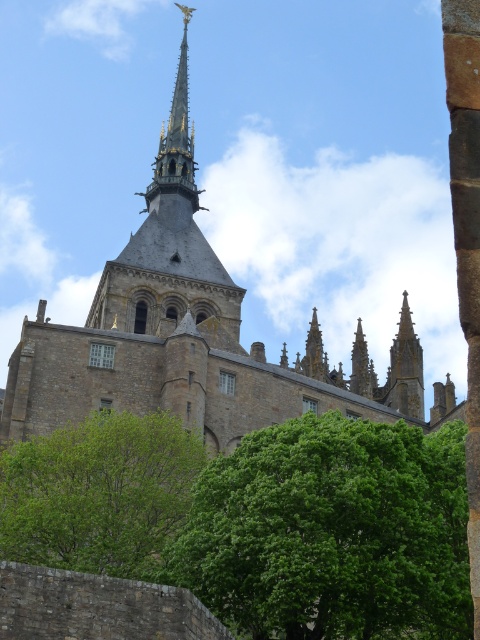
You are standing in front of the Gothic cathedral and notice two green leafy trees. Which tree, the green leafy tree at center or the green leafy tree at lower left, is located more to the left?

The green leafy tree at lower left is more to the left because the green leafy tree at center is positioned on the right side of it.

You are standing in front of the dark gray stone church tower at center and want to take a photo of the green leafy tree at lower left. Which direction should you turn to frame the tree in your camera?

The dark gray stone church tower at center is taller than the green leafy tree at lower left. To frame the tree in your camera, you should turn to the left side of the church tower since the tree is positioned at the lower left relative to the tower.

You are standing in a field and see the green leafy tree at lower left and the dark gray stone church tower at center. Which object appears smaller in the image?

The green leafy tree at lower left appears smaller compared to the dark gray stone church tower at center.